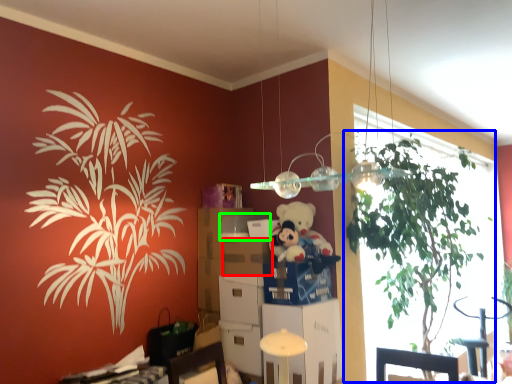
Question: Which object is the closest to the drawer (highlighted by a red box)? Choose among these: houseplant (highlighted by a blue box) or box (highlighted by a green box).

Choices:
 (A) houseplant
 (B) box

Answer: (B)